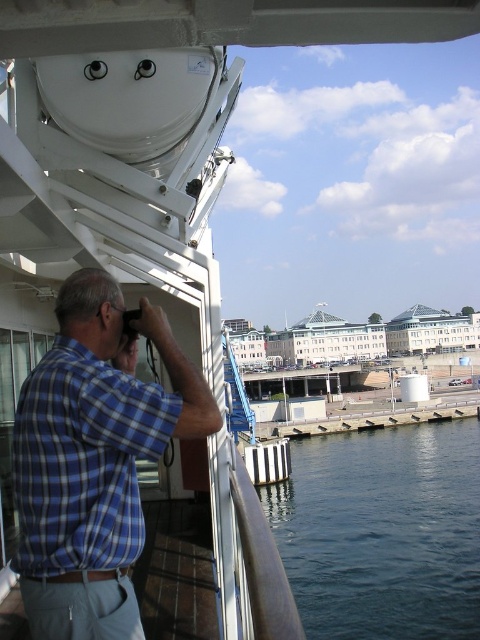
Does blue plaid shirt at left appear over dark blue water at lower right?

Correct, blue plaid shirt at left is located above dark blue water at lower right.

Is point (91, 584) in front of point (360, 557)?

Yes, point (91, 584) is closer to viewer.

In order to click on blue plaid shirt at left in this screenshot , I will do `click(94, 458)`.